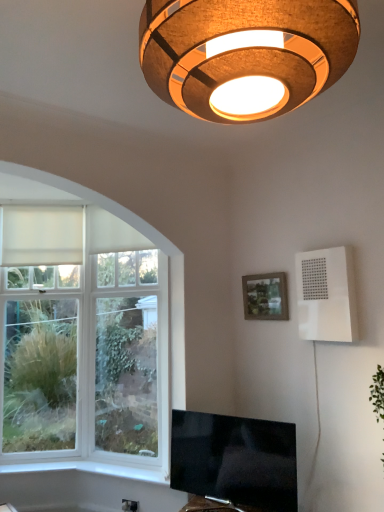
Question: From the image's perspective, is matte brown lampshade at upper center located above or below white smooth window sill at lower left?

Choices:
 (A) above
 (B) below

Answer: (A)

Question: Considering their positions, is matte brown lampshade at upper center located in front of or behind white smooth window sill at lower left?

Choices:
 (A) behind
 (B) front

Answer: (B)

Question: Estimate the real-world distances between objects in this image. Which object is closer to the flat-screen tv at lower center?

Choices:
 (A) white plastic electric outlet at lower center
 (B) white plastic speaker at upper right
 (C) white matte curtain at left
 (D) matte brown lampshade at upper center
 (E) matte wooden picture frame at upper right

Answer: (A)

Question: Considering the real-world distances, which object is closest to the white plastic speaker at upper right?

Choices:
 (A) matte wooden picture frame at upper right
 (B) white plastic electric outlet at lower center
 (C) flat-screen tv at lower center
 (D) white matte curtain at left
 (E) matte brown lampshade at upper center

Answer: (A)